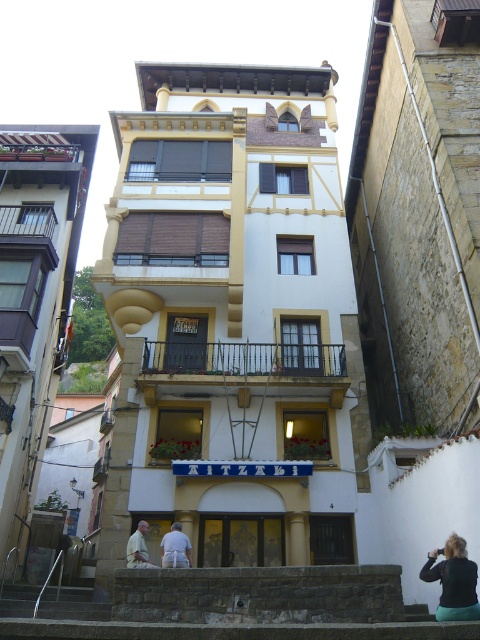
Question: Does black fabric at lower right come in front of white cotton shirt at center?

Choices:
 (A) no
 (B) yes

Answer: (B)

Question: Which point is closer to the camera taking this photo?

Choices:
 (A) (180, 560)
 (B) (442, 618)
 (C) (146, 522)

Answer: (B)

Question: Among these points, which one is nearest to the camera?

Choices:
 (A) (469, 604)
 (B) (154, 566)
 (C) (176, 522)

Answer: (A)

Question: Is black fabric at lower right below light brown leather jacket at center?

Choices:
 (A) no
 (B) yes

Answer: (A)

Question: Can you confirm if white cotton shirt at center is positioned above light brown leather jacket at center?

Choices:
 (A) yes
 (B) no

Answer: (A)

Question: Considering the real-world distances, which object is farthest from the white cotton shirt at center?

Choices:
 (A) light brown leather jacket at center
 (B) black fabric at lower right

Answer: (B)